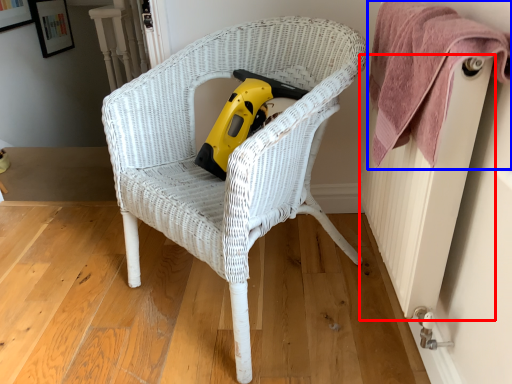
Question: Which object is closer to the camera taking this photo, radiator (highlighted by a red box) or towel (highlighted by a blue box)?

Choices:
 (A) radiator
 (B) towel

Answer: (A)